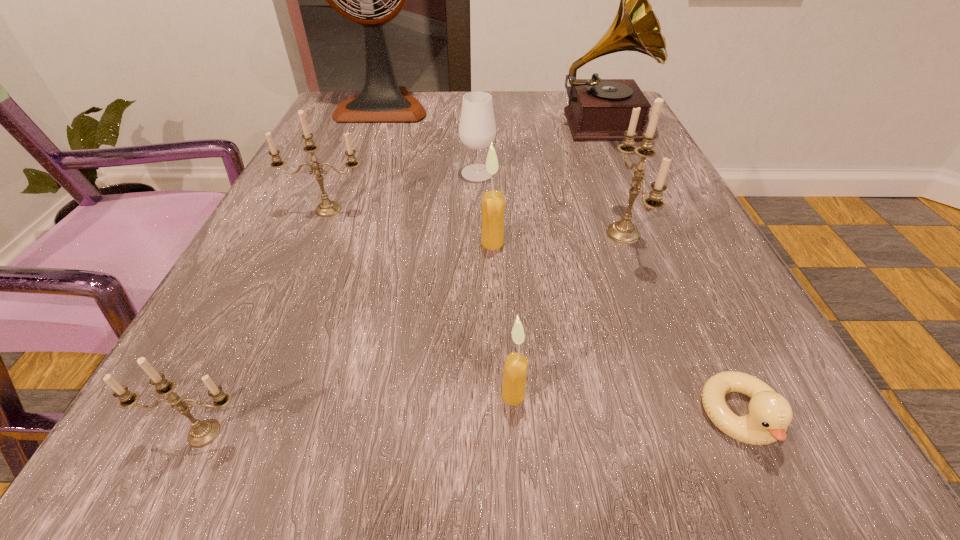
In the image, there is a desktop. Where is `vacant space at the far right corner`? This screenshot has height=540, width=960. vacant space at the far right corner is located at coordinates (568, 102).

Locate an element on the screen. The width and height of the screenshot is (960, 540). free area in between the shortest object and the smallest metallic candle is located at coordinates [x=473, y=425].

Identify the location of vacant space in between the smaller cream candle and the eighth shortest object. (557, 260).

The height and width of the screenshot is (540, 960). In order to click on empty location between the brown fan and the bigger cream candle in this screenshot , I will do `click(438, 175)`.

The height and width of the screenshot is (540, 960). Identify the location of free spot between the farther cream candle and the brown fan. (438, 175).

Find the location of a particular element. Image resolution: width=960 pixels, height=540 pixels. vacant area between the rightmost candle and the fourth farthest candle is located at coordinates (568, 314).

Identify the location of vacant space that's between the second tallest object and the third farthest object. (539, 149).

In order to click on blank region between the brown fan and the bigger cream candle in this screenshot , I will do `click(438, 175)`.

At what (x,y) coordinates should I click in order to perform the action: click on free spot between the second biggest metallic candle and the glass. Please return your answer as a coordinate pair (x, y). The height and width of the screenshot is (540, 960). Looking at the image, I should click on (403, 191).

You are a GUI agent. You are given a task and a screenshot of the screen. Output one action in this format:
    pyautogui.click(x=<x>, y=<y>)
    Task: Click on the free space between the nearer cream candle and the farther cream candle
    This screenshot has height=540, width=960.
    Given the screenshot: What is the action you would take?
    pyautogui.click(x=503, y=319)